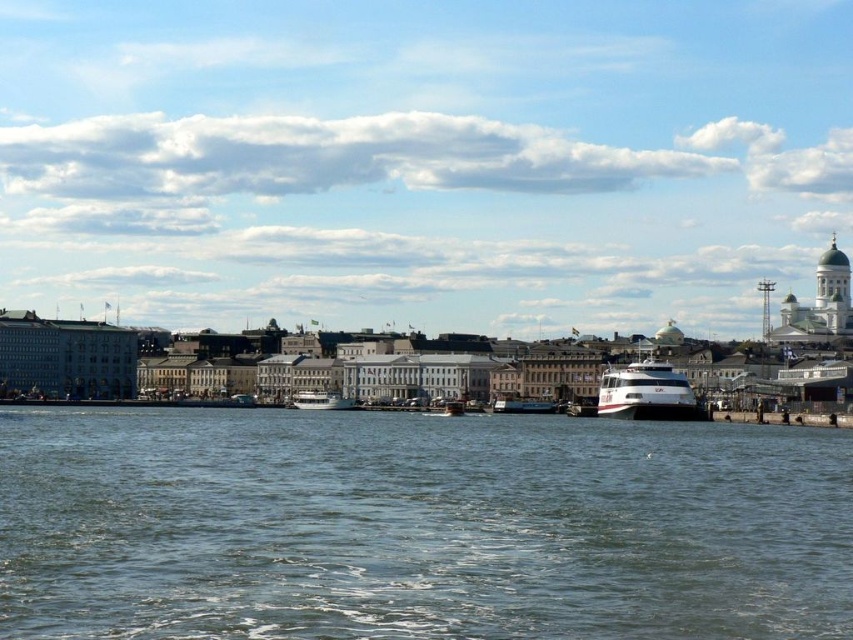
Question: Observing the image, what is the correct spatial positioning of blue water at center in reference to white glossy ferry at center?

Choices:
 (A) right
 (B) left

Answer: (B)

Question: Which point is farther from the camera taking this photo?

Choices:
 (A) (305, 390)
 (B) (553, 404)
 (C) (402, 595)

Answer: (A)

Question: Does blue water at center have a larger size compared to metallic blue boat at center?

Choices:
 (A) no
 (B) yes

Answer: (B)

Question: Among these objects, which one is farthest from the camera?

Choices:
 (A) blue water at center
 (B) white glossy ferry at center

Answer: (B)

Question: Estimate the real-world distances between objects in this image. Which object is farther from the white glossy ferry at center?

Choices:
 (A) metallic blue boat at center
 (B) blue water at center
 (C) white glossy boat at center

Answer: (C)

Question: Does blue water at center appear under white glossy ferry at center?

Choices:
 (A) yes
 (B) no

Answer: (A)